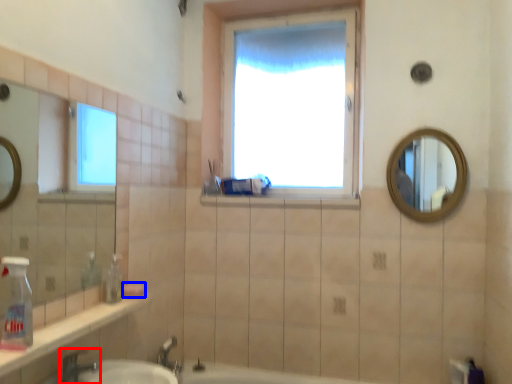
Question: Among these objects, which one is nearest to the camera, tap (highlighted by a red box) or soap (highlighted by a blue box)?

Choices:
 (A) tap
 (B) soap

Answer: (A)